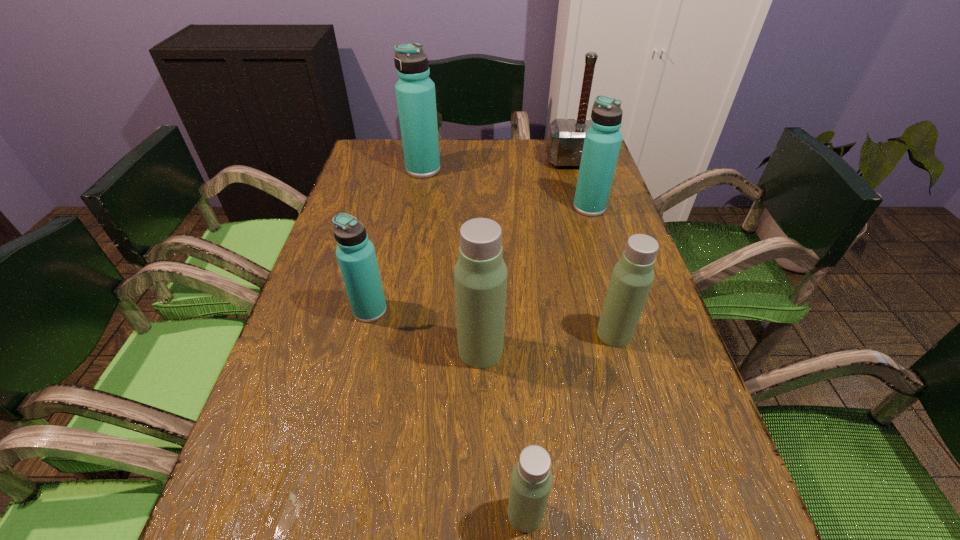
In order to click on the farthest thermos bottle in this screenshot , I will do `click(415, 91)`.

Locate an element on the screen. the biggest aqua thermos bottle is located at coordinates pos(415,91).

This screenshot has width=960, height=540. Identify the location of brown hammer. (565, 140).

This screenshot has width=960, height=540. Find the location of `the rightmost aqua thermos bottle`. the rightmost aqua thermos bottle is located at coordinates (602, 142).

Locate an element on the screen. the second nearest aqua thermos bottle is located at coordinates (602, 142).

Find the location of a particular element. the biggest light thermos bottle is located at coordinates pos(480,275).

At what (x,y) coordinates should I click in order to perform the action: click on the nearest aqua thermos bottle. Please return your answer as a coordinate pair (x, y). The height and width of the screenshot is (540, 960). Looking at the image, I should click on point(355,253).

Locate an element on the screen. This screenshot has width=960, height=540. the rightmost light thermos bottle is located at coordinates (633, 275).

Find the location of a particular element. the nearest object is located at coordinates (531, 480).

Identify the location of the smallest light thermos bottle. (531, 480).